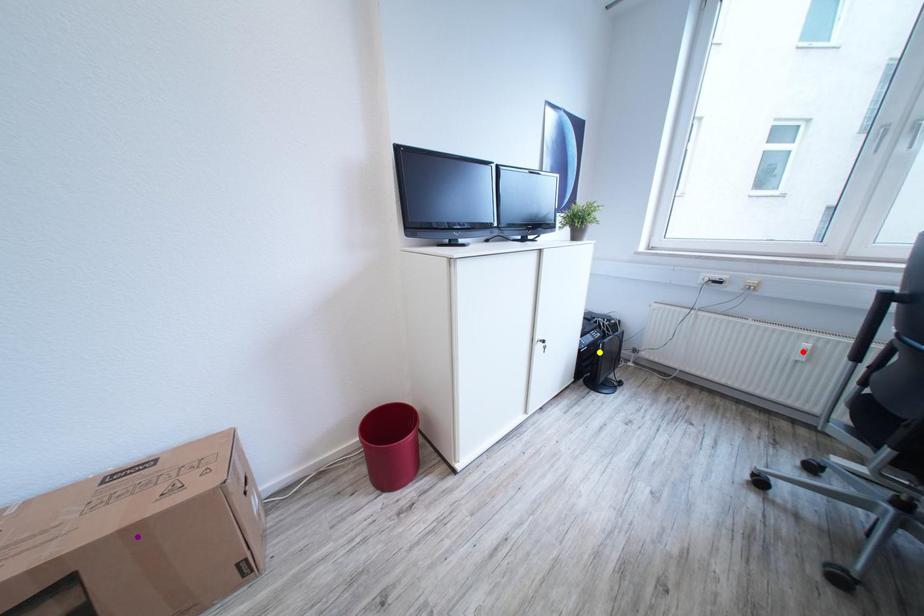
Order these from nearest to farthest:
yellow point | red point | purple point

yellow point < red point < purple point